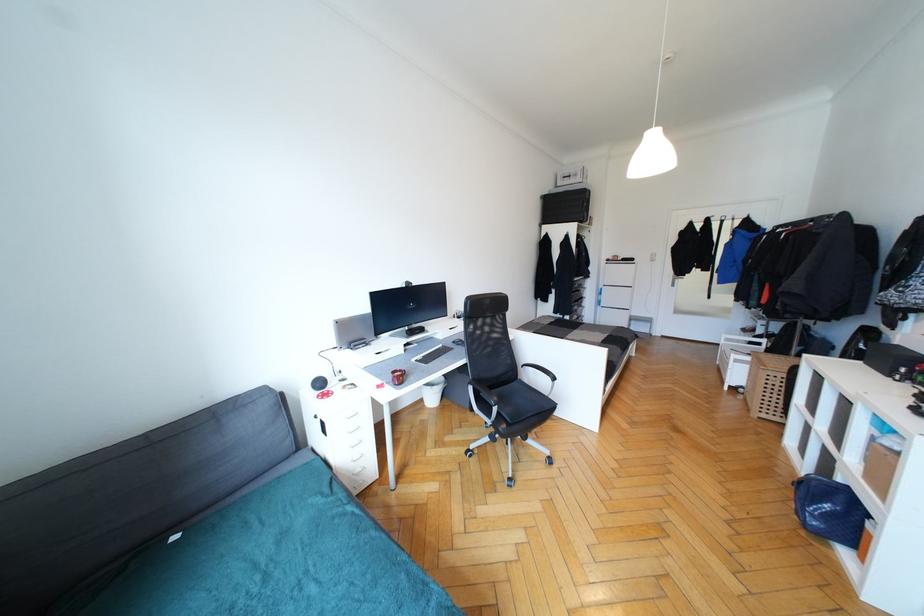
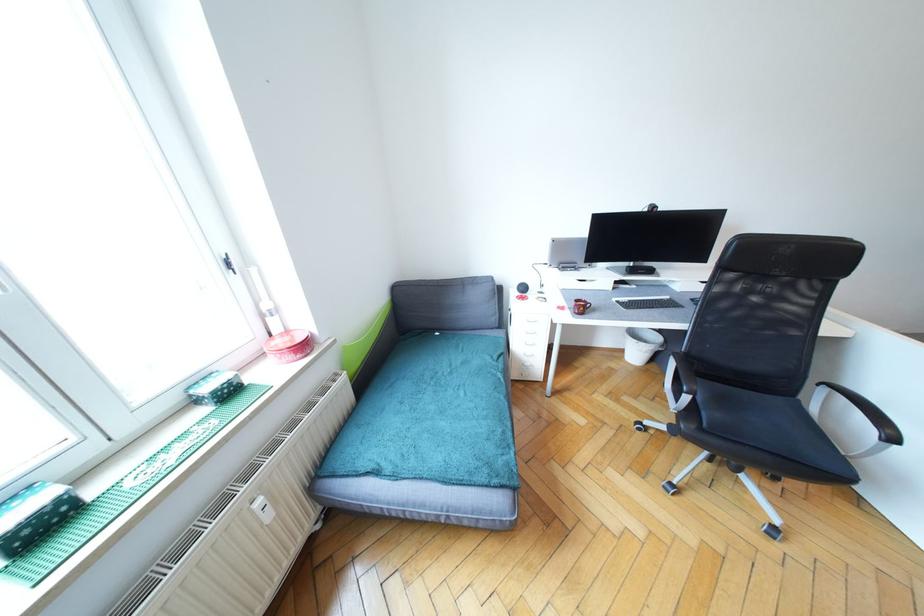
Where in the second image is the point corresponding to (x=424, y=402) from the first image?

(625, 352)